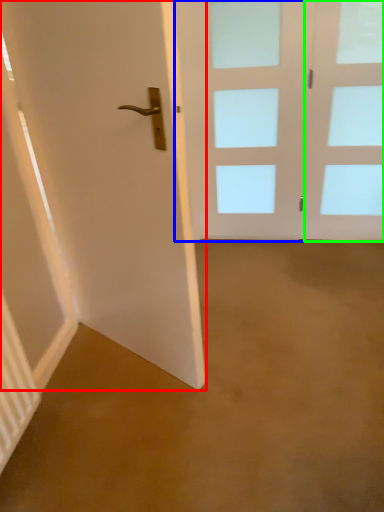
Question: Which is farther away from door (highlighted by a red box)? door (highlighted by a blue box) or glass door (highlighted by a green box)?

Choices:
 (A) door
 (B) glass door

Answer: (B)